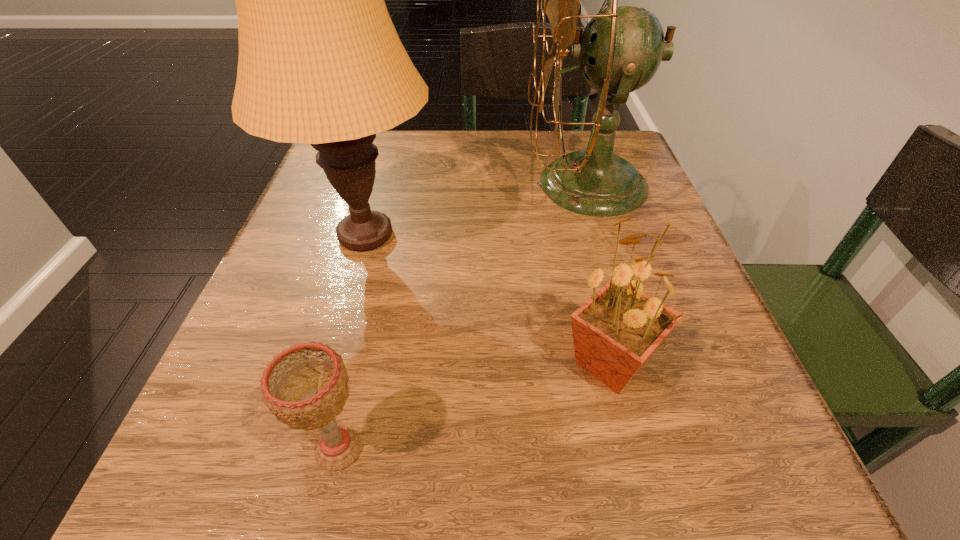
Where is `fan`? This screenshot has height=540, width=960. fan is located at coordinates (621, 48).

At what (x,y) coordinates should I click in order to perform the action: click on lampshade. Please return your answer as a coordinate pair (x, y). The height and width of the screenshot is (540, 960). Looking at the image, I should click on (320, 62).

The width and height of the screenshot is (960, 540). I want to click on sunflower, so click(x=615, y=332).

Find the location of `the third tallest object`. the third tallest object is located at coordinates (615, 332).

Identify the location of the shortest object. The width and height of the screenshot is (960, 540). (305, 386).

I want to click on chalice, so click(305, 386).

Where is `free point located 0.200m in front of the fan, directing air flow`? The height and width of the screenshot is (540, 960). free point located 0.200m in front of the fan, directing air flow is located at coordinates (427, 184).

Locate an element on the screen. free spot located in front of the fan, directing air flow is located at coordinates (497, 184).

Locate an element on the screen. The height and width of the screenshot is (540, 960). vacant space situated in front of the fan, directing air flow is located at coordinates (352, 184).

Where is `free space located on the right of the lampshade`? Image resolution: width=960 pixels, height=540 pixels. free space located on the right of the lampshade is located at coordinates (635, 235).